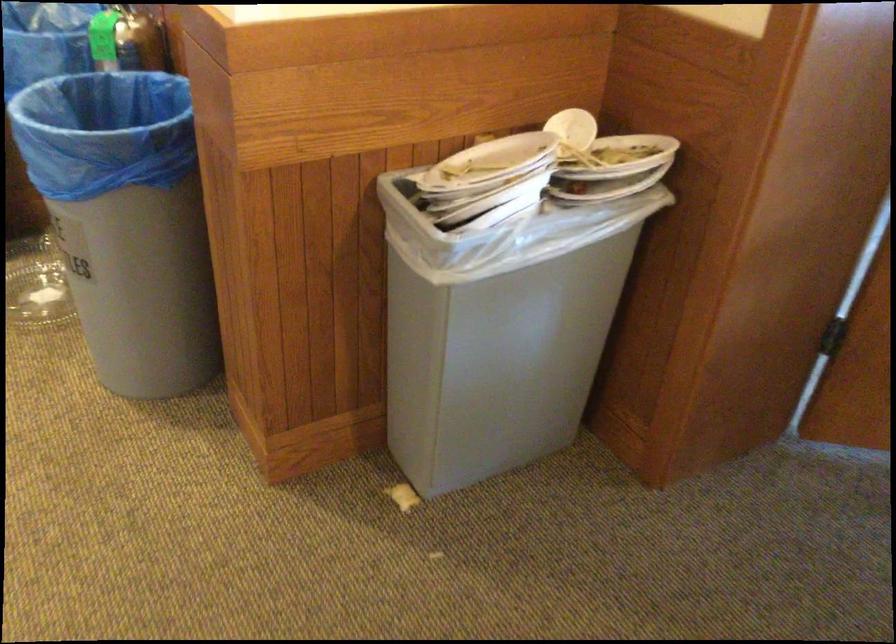
Where is `blue trash bag edge`? The width and height of the screenshot is (896, 644). blue trash bag edge is located at coordinates (114, 140).